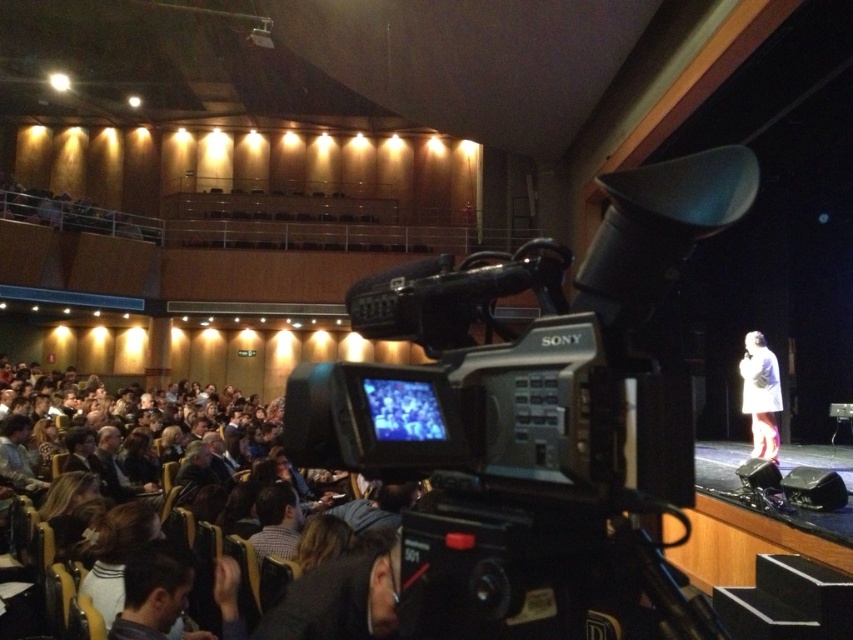
Does black plastic video camera at center have a larger size compared to white matte coat at stage right?

Actually, black plastic video camera at center might be smaller than white matte coat at stage right.

Between point (682, 186) and point (753, 333), which one is positioned behind?

Point (753, 333)

Identify the location of black plastic video camera at center. (531, 416).